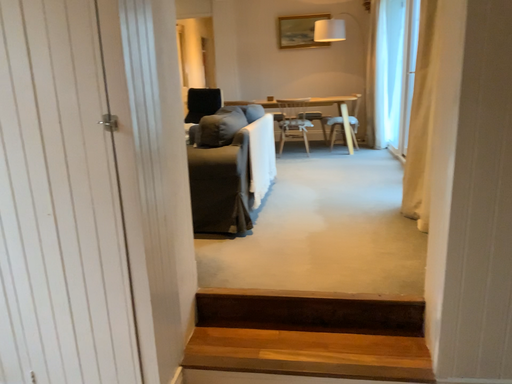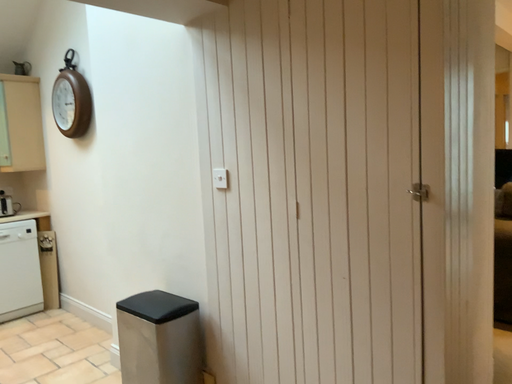
Question: How did the camera likely rotate when shooting the video?

Choices:
 (A) rotated left
 (B) rotated right

Answer: (A)